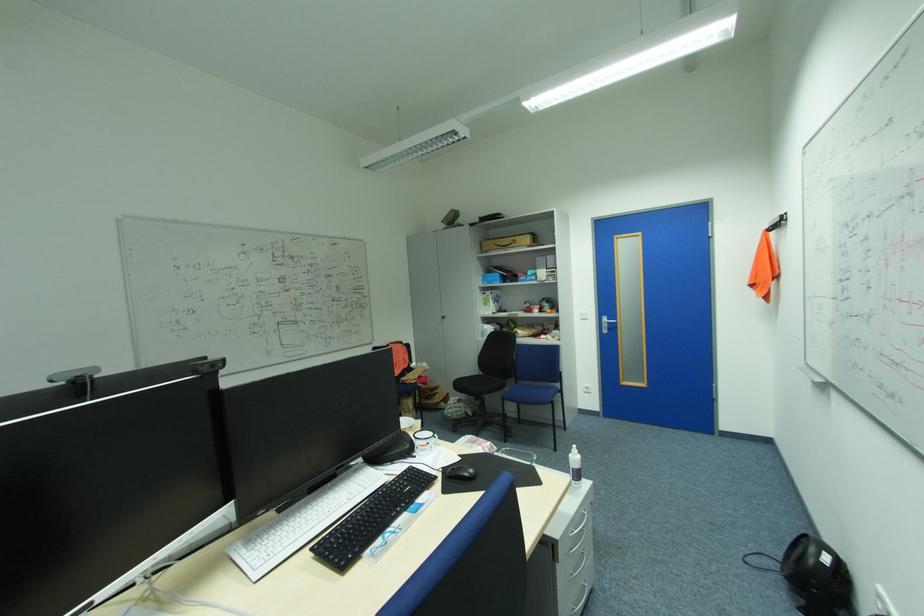
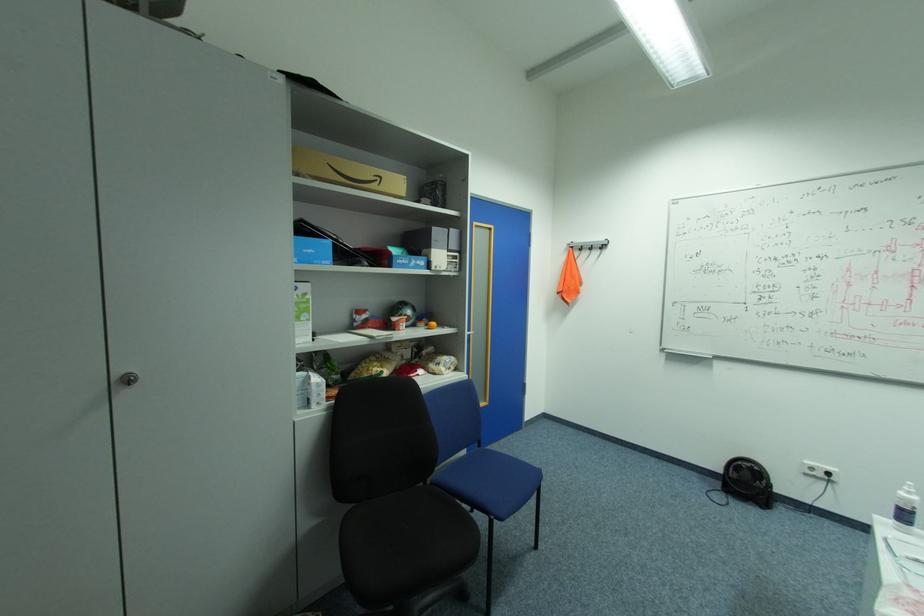
Where in the second image is the point corresponding to (492,331) from the first image?

(321, 387)